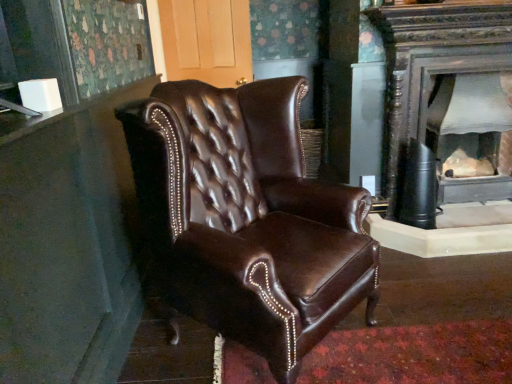
Question: Considering the positions of point (245, 92) and point (454, 178), is point (245, 92) closer or farther from the camera than point (454, 178)?

Choices:
 (A) closer
 (B) farther

Answer: (A)

Question: Choose the correct answer: Is brown leather chair at center inside matte black fireplace at right or outside it?

Choices:
 (A) outside
 (B) inside

Answer: (A)

Question: In terms of width, does brown leather chair at center look wider or thinner when compared to matte black fireplace at right?

Choices:
 (A) thin
 (B) wide

Answer: (B)

Question: Is matte black fireplace at right spatially inside brown leather chair at center, or outside of it?

Choices:
 (A) outside
 (B) inside

Answer: (A)

Question: From their relative heights in the image, would you say matte black fireplace at right is taller or shorter than brown leather chair at center?

Choices:
 (A) short
 (B) tall

Answer: (A)

Question: From a real-world perspective, is matte black fireplace at right positioned above or below brown leather chair at center?

Choices:
 (A) above
 (B) below

Answer: (B)

Question: Considering the relative positions of matte black fireplace at right and brown leather chair at center in the image provided, is matte black fireplace at right to the left or to the right of brown leather chair at center?

Choices:
 (A) left
 (B) right

Answer: (B)